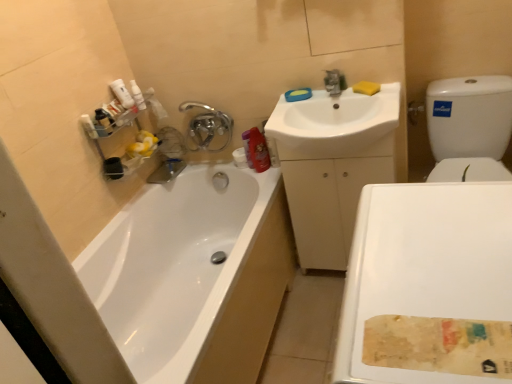
Question: Can you confirm if white glossy bathtub at left is taller than yellow sponge at upper center?

Choices:
 (A) yes
 (B) no

Answer: (A)

Question: Is white glossy bathtub at left bigger than yellow sponge at upper center?

Choices:
 (A) yes
 (B) no

Answer: (A)

Question: From a real-world perspective, is white glossy bathtub at left beneath yellow sponge at upper center?

Choices:
 (A) no
 (B) yes

Answer: (B)

Question: Would you consider white glossy bathtub at left to be distant from yellow sponge at upper center?

Choices:
 (A) yes
 (B) no

Answer: (A)

Question: Is white glossy bathtub at left positioned behind yellow sponge at upper center?

Choices:
 (A) yes
 (B) no

Answer: (B)

Question: From the image's perspective, is white glossy bathtub at left on yellow sponge at upper center?

Choices:
 (A) yes
 (B) no

Answer: (B)

Question: Is white glossy toilet at right turned away from silver metallic faucet at upper center?

Choices:
 (A) no
 (B) yes

Answer: (A)

Question: From the image's perspective, is white glossy toilet at right on silver metallic faucet at upper center?

Choices:
 (A) yes
 (B) no

Answer: (B)

Question: Does white glossy toilet at right turn towards silver metallic faucet at upper center?

Choices:
 (A) no
 (B) yes

Answer: (A)

Question: Does white glossy toilet at right have a lesser width compared to silver metallic faucet at upper center?

Choices:
 (A) no
 (B) yes

Answer: (A)

Question: Is there a large distance between white glossy toilet at right and silver metallic faucet at upper center?

Choices:
 (A) no
 (B) yes

Answer: (B)

Question: From the image's perspective, is white glossy toilet at right located beneath silver metallic faucet at upper center?

Choices:
 (A) no
 (B) yes

Answer: (B)

Question: Is silver metallic faucet at upper center not inside white glossy sink at upper center?

Choices:
 (A) yes
 (B) no

Answer: (A)